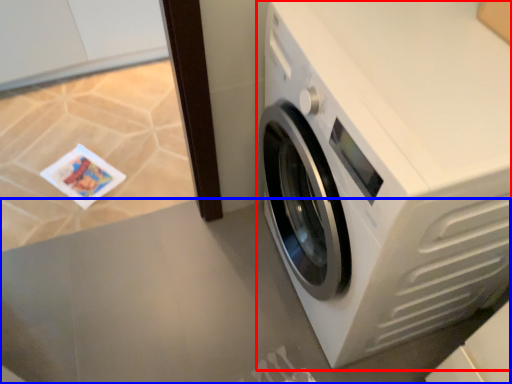
Question: Which object is further to the camera taking this photo, washing machine (highlighted by a red box) or table top (highlighted by a blue box)?

Choices:
 (A) washing machine
 (B) table top

Answer: (B)